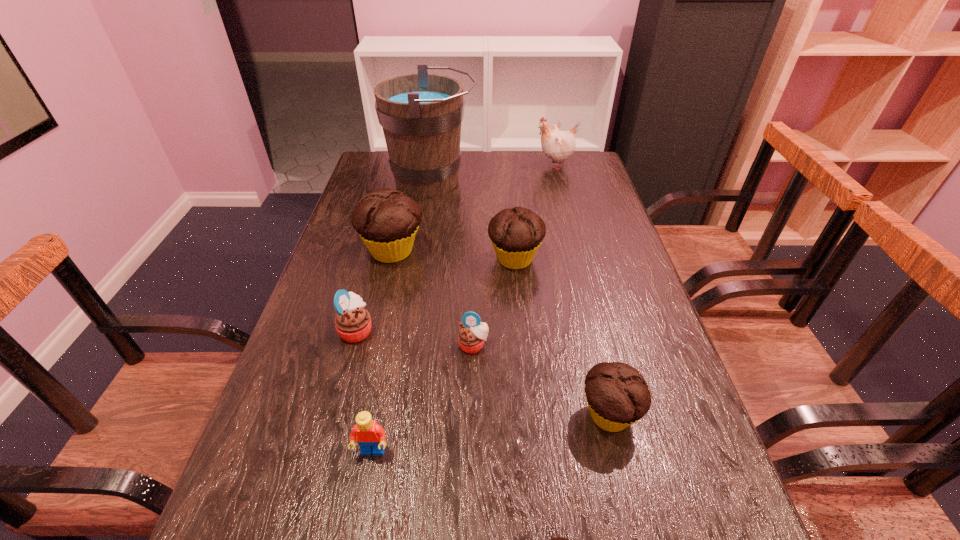
Image resolution: width=960 pixels, height=540 pixels. I want to click on free space located 0.090m on the face of the Lego, so click(x=360, y=517).

Locate an element on the screen. vacant space located on the front-facing side of the third muffin from left to right is located at coordinates (471, 460).

Identify the location of wine bucket at the far edge. (421, 114).

Image resolution: width=960 pixels, height=540 pixels. Identify the location of bird that is at the far edge. (557, 145).

Where is `wine bucket at the left edge`? The image size is (960, 540). wine bucket at the left edge is located at coordinates (421, 114).

Where is `bird that is at the right edge`? bird that is at the right edge is located at coordinates (557, 145).

You are a GUI agent. You are given a task and a screenshot of the screen. Output one action in this format:
    pyautogui.click(x=<x>, y=<y>)
    Task: Click on the muffin at the right edge
    
    Given the screenshot: What is the action you would take?
    pyautogui.click(x=617, y=394)

Where is `object at the far left corner`? This screenshot has height=540, width=960. object at the far left corner is located at coordinates (421, 114).

Image resolution: width=960 pixels, height=540 pixels. What are the coordinates of `object positioned at the far right corner` in the screenshot? It's located at (557, 145).

The width and height of the screenshot is (960, 540). I want to click on vacant space at the far edge of the desktop, so pyautogui.click(x=497, y=157).